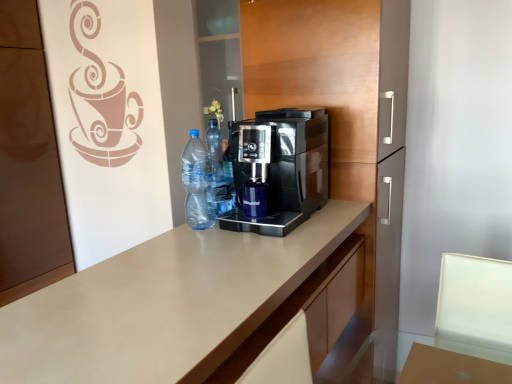
Question: Considering the positions of black glossy coffee machine at center and transparent glass table at lower right in the image, is black glossy coffee machine at center bigger or smaller than transparent glass table at lower right?

Choices:
 (A) big
 (B) small

Answer: (A)

Question: Would you say black glossy coffee machine at center is to the left or to the right of transparent glass table at lower right in the picture?

Choices:
 (A) right
 (B) left

Answer: (B)

Question: Which object is the farthest from the black glossy coffee maker at center?

Choices:
 (A) black glossy coffee machine at center
 (B) beige laminate countertop at center
 (C) transparent plastic bottle at center, which is the first bottle in front-to-back order
 (D) transparent glass table at lower right
 (E) translucent plastic bottles at center, arranged as the second bottle when viewed from the front

Answer: (D)

Question: Considering the real-world distances, which object is farthest from the beige laminate countertop at center?

Choices:
 (A) transparent plastic bottle at center, which is the first bottle in front-to-back order
 (B) black glossy coffee maker at center
 (C) transparent glass table at lower right
 (D) translucent plastic bottles at center, arranged as the second bottle when viewed from the front
 (E) black glossy coffee machine at center

Answer: (C)